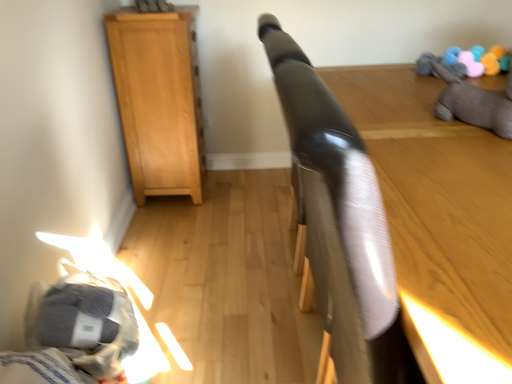
Locate an element on the screen. free space to the left of gray plush toy at upper right is located at coordinates (406, 128).